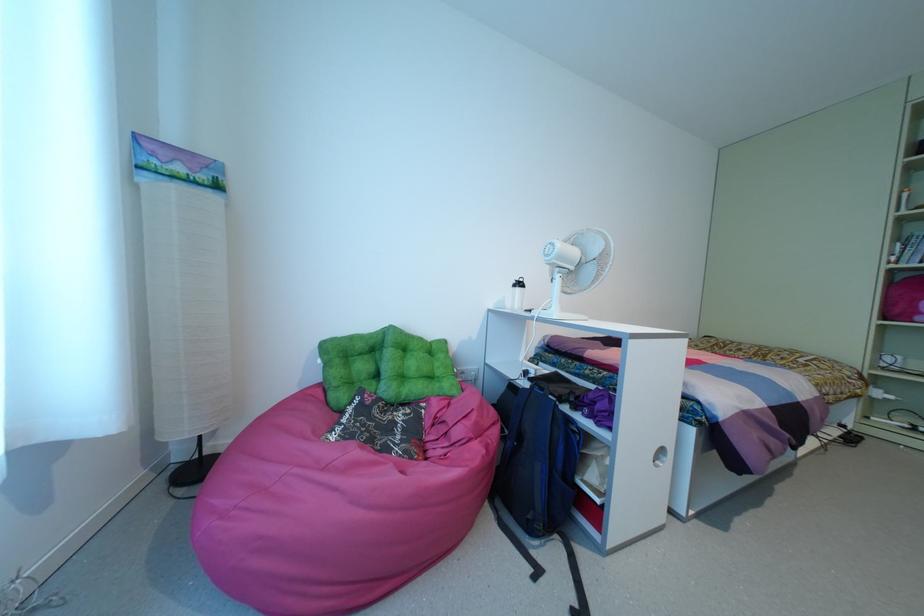
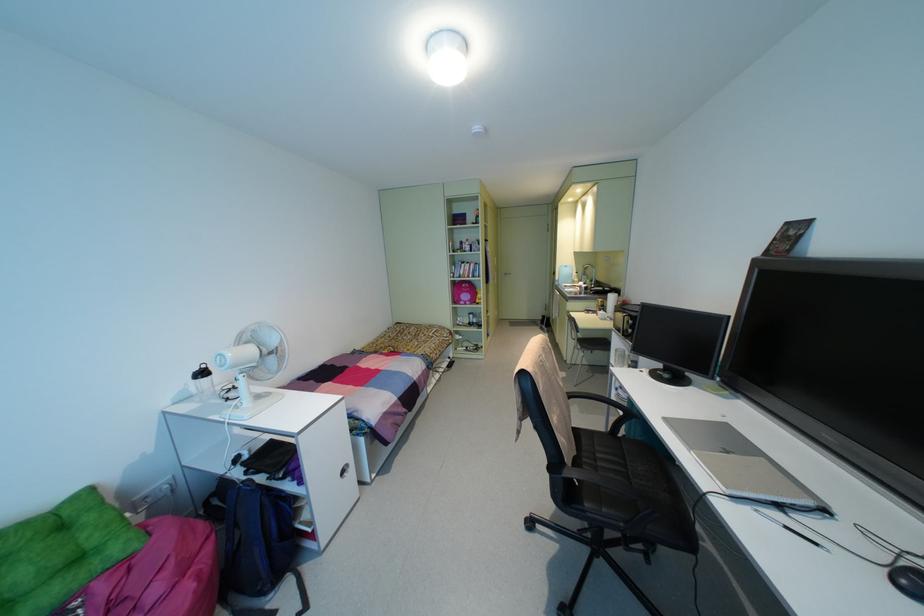
Question: How did the camera likely rotate?

Choices:
 (A) Left
 (B) Right
 (C) Up
 (D) Down

Answer: (B)